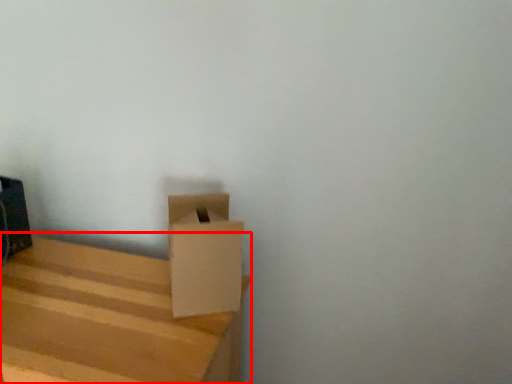
Question: From the image's perspective, considering the relative positions of furniture (annotated by the red box) and cardboard box in the image provided, where is furniture (annotated by the red box) located with respect to the staircase?

Choices:
 (A) below
 (B) above

Answer: (A)